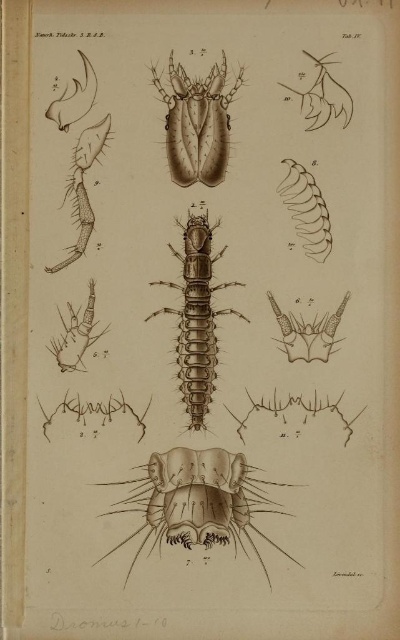
Based on the scene description, which object is closer to the viewer between the brown textured centipede at center and the brown textured insect at center?

The brown textured centipede at center is closer to the viewer since it is 6.16 inches from the brown textured insect at center.

Based on the scene description, which object is positioned lower in the image between the brown textured centipede at center and the brown textured insect at center?

The brown textured centipede at center is positioned lower than the brown textured insect at center in the image.

Based on the provided scientific illustration labeled Tab. IV from the publication Naturh. Tidskr. J. B. B., you are an entomologist examining the central figures. The illustration shows a brown textured centipede at center and a brown textured insect at center. Which of these two organisms has a wider body structure according to the description?

The brown textured centipede at center might be wider than brown textured insect at center according to the description.